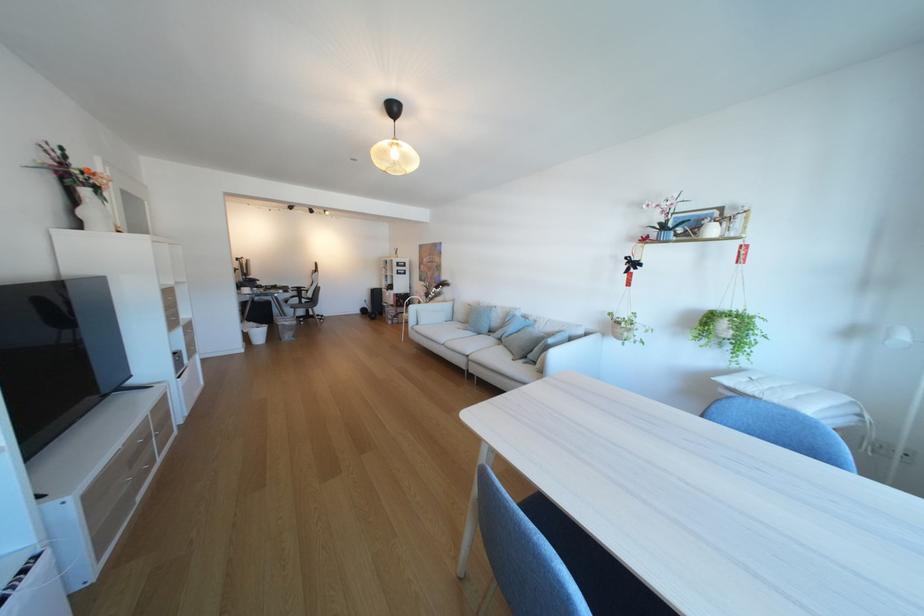
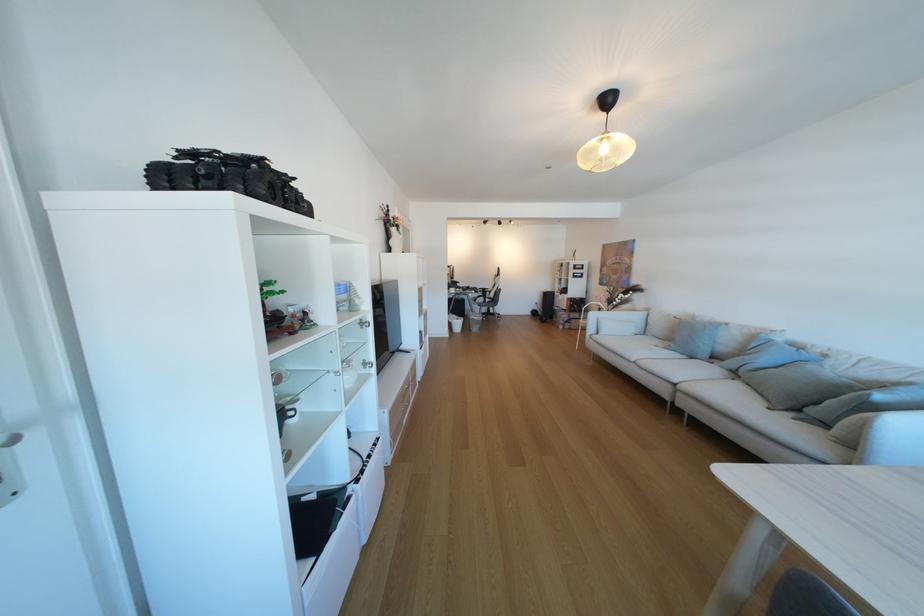
In the second image, find the point that corresponds to [297,323] in the first image.

(485, 317)